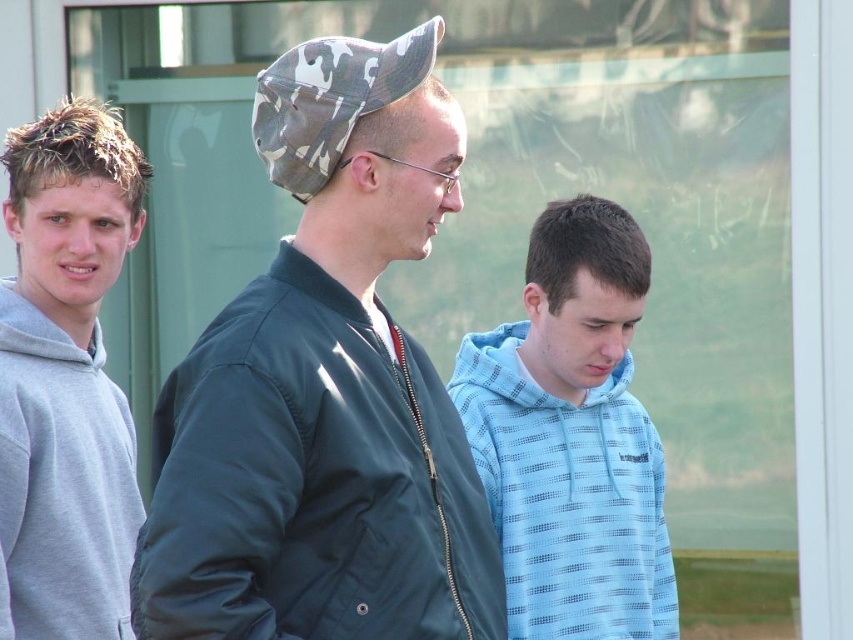
Consider the image. Is light blue hoodie at center positioned before gray fleece hoodie at left?

Yes, it is.

Is light blue hoodie at center positioned at the back of gray fleece hoodie at left?

No, light blue hoodie at center is closer to the viewer.

Measure the distance between light blue hoodie at center and camera.

They are 6.08 meters apart.

At what (x,y) coordinates should I click in order to perform the action: click on light blue hoodie at center. Please return your answer as a coordinate pair (x, y). The height and width of the screenshot is (640, 853). Looking at the image, I should click on (572, 436).

Does light blue hoodie at center appear on the right side of camouflage fabric baseball cap at center?

Correct, you'll find light blue hoodie at center to the right of camouflage fabric baseball cap at center.

Who is lower down, light blue hoodie at center or camouflage fabric baseball cap at center?

light blue hoodie at center

Is point (595, 384) more distant than point (434, 20)?

Yes, point (595, 384) is farther from viewer.

Find the location of a particular element. This screenshot has width=853, height=640. light blue hoodie at center is located at coordinates (572, 436).

Is dark green jacket at center closer to the viewer compared to light blue hoodie at center?

That is True.

Does point (254, 531) come farther from viewer compared to point (598, 396)?

No, it is not.

At what (x,y) coordinates should I click in order to perform the action: click on dark green jacket at center. Please return your answer as a coordinate pair (x, y). This screenshot has height=640, width=853. Looking at the image, I should click on (325, 388).